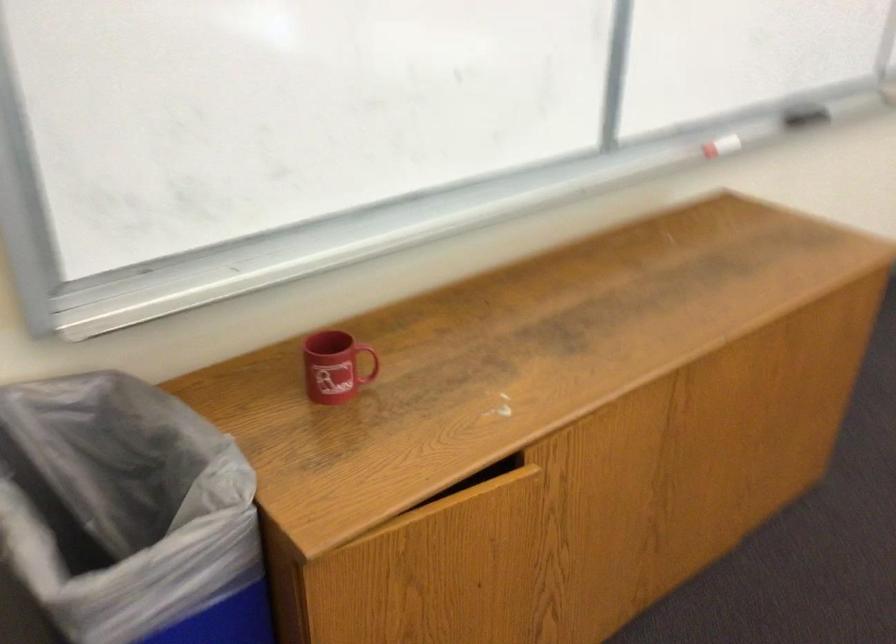
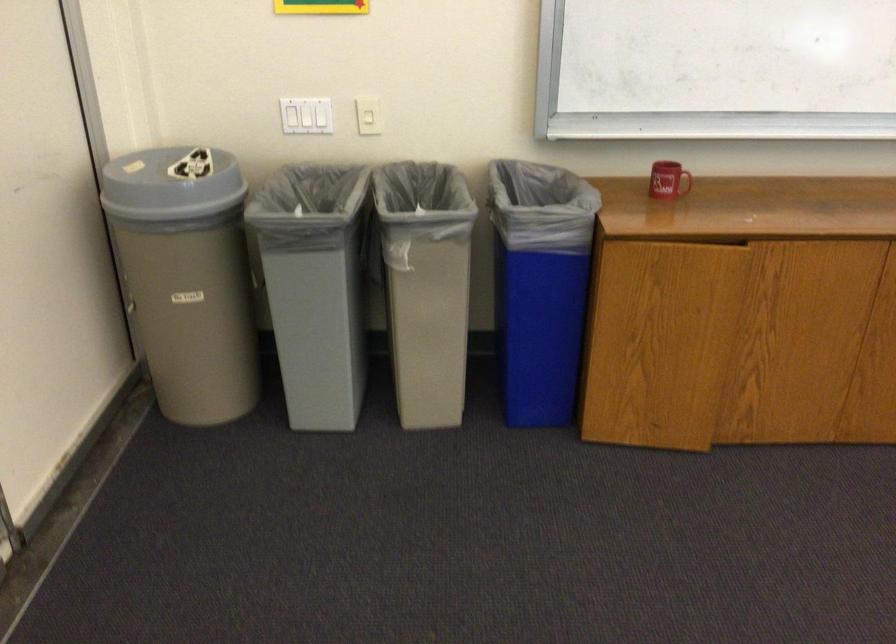
The point at (500, 456) is marked in the first image. Where is the corresponding point in the second image?

(736, 242)